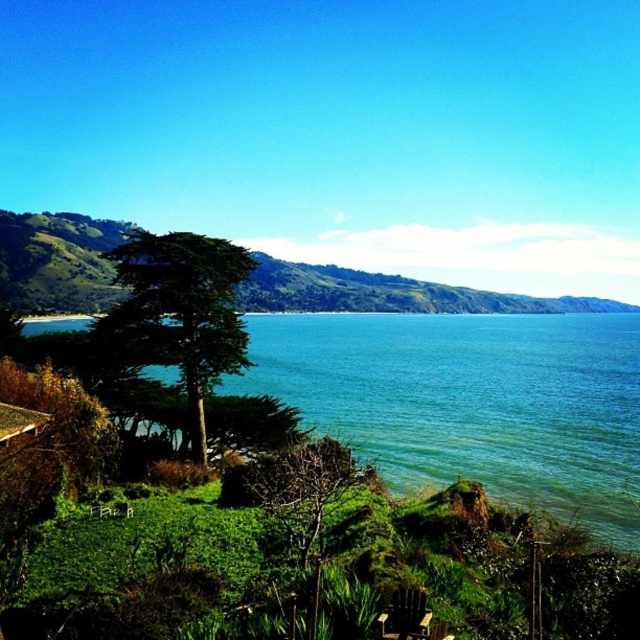
Question: Is the position of green grassy hillside at upper left more distant than that of green leafy tree at lower center?

Choices:
 (A) yes
 (B) no

Answer: (A)

Question: Among these objects, which one is nearest to the camera?

Choices:
 (A) green leafy tree at center-left
 (B) green grassy hillside at upper left
 (C) green leafy tree at lower center

Answer: (C)

Question: Which of the following is the closest to the observer?

Choices:
 (A) green leafy tree at lower center
 (B) blue water at center

Answer: (A)

Question: Which point is closer to the camera taking this photo?

Choices:
 (A) [x=387, y=451]
 (B) [x=304, y=563]
 (C) [x=225, y=348]

Answer: (B)

Question: From the image, what is the correct spatial relationship of blue water at center in relation to green leafy tree at center-left?

Choices:
 (A) left
 (B) right

Answer: (B)

Question: Can you confirm if green grassy hillside at upper left is positioned below green leafy tree at center-left?

Choices:
 (A) no
 (B) yes

Answer: (A)